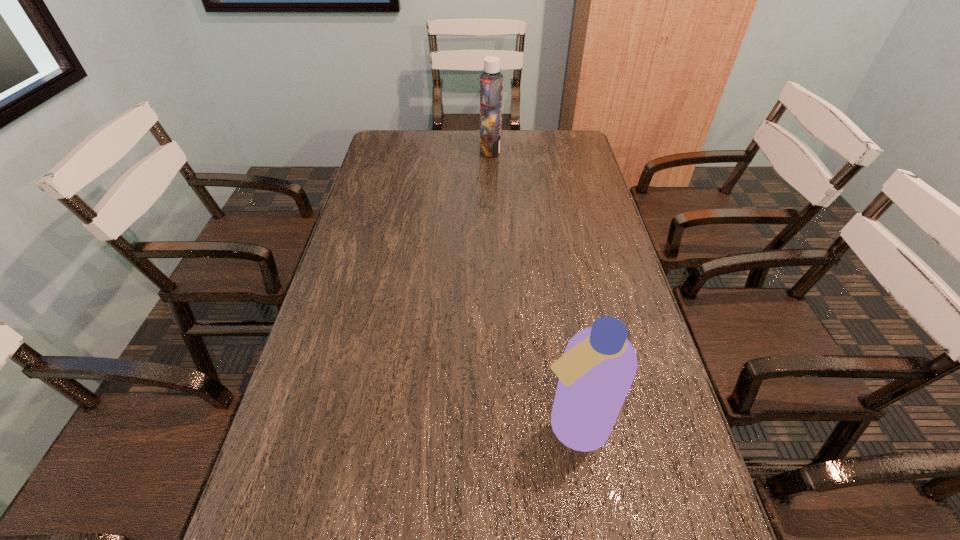
Where is `vacant space at the far edge of the desktop`? vacant space at the far edge of the desktop is located at coordinates (461, 130).

The image size is (960, 540). Find the location of `free space at the left edge of the desktop`. free space at the left edge of the desktop is located at coordinates (345, 482).

Locate an element on the screen. This screenshot has width=960, height=540. blank space at the right edge of the desktop is located at coordinates (597, 180).

Where is `free space at the far left corner of the desktop`? free space at the far left corner of the desktop is located at coordinates (398, 155).

Locate an element on the screen. free spot between the farthest object and the rightmost object is located at coordinates (531, 288).

Image resolution: width=960 pixels, height=540 pixels. Find the location of `vacant area between the second object from left to right and the right shampoo`. vacant area between the second object from left to right and the right shampoo is located at coordinates (531, 288).

Locate an element on the screen. object that is the second closest to the second object from left to right is located at coordinates (416, 539).

I want to click on object identified as the closest to the second farthest object, so click(x=416, y=539).

At what (x,y) coordinates should I click in order to perform the action: click on the second closest shampoo to the shortest object. Please return your answer as a coordinate pair (x, y). Looking at the image, I should click on (491, 81).

The width and height of the screenshot is (960, 540). In order to click on vacant space that satisfies the following two spatial constraints: 1. on the front label of the left shampoo; 2. on the back side of the right shampoo in this screenshot , I will do `click(499, 426)`.